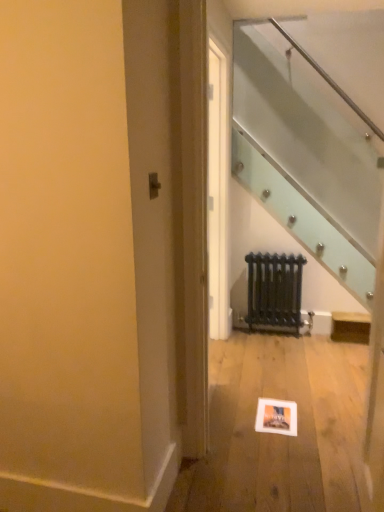
Locate an element on the screen. empty space that is in between black metal radiator at center and matte orange picture frame at lower center is located at coordinates (273, 360).